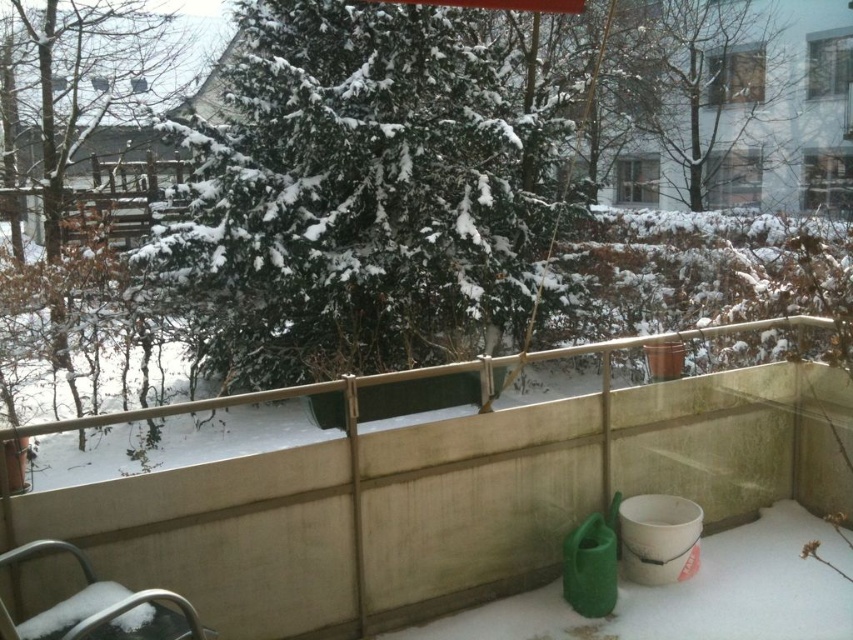
You are standing on the balcony and want to take a photo of the green textured tree at upper center. Which direction should you face to ensure the tree is centered in your camera view?

The green textured tree at upper center is located at point (718, 104), so you should face towards the upper center direction to center it in your camera view.